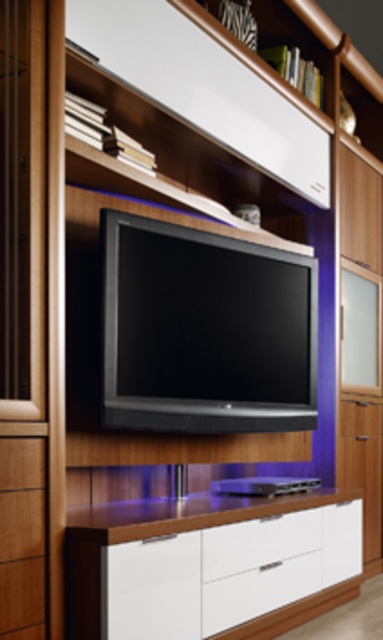
You are organizing the entertainment unit and need to know which object takes up more space. Which one is larger in size between the black glossy flat screen tv at center and the white glossy drawer at lower center?

The white glossy drawer at lower center is larger in size than the black glossy flat screen tv at center because the black glossy flat screen tv at center occupies less space than white glossy drawer at lower center.

You are organizing a living room and want to place a remote control on the entertainment unit. You have two drawers available for storage. Which drawer is positioned to the right when facing the entertainment unit, the white glossy drawer at lower center or the wooden drawer at lower left?

The white glossy drawer at lower center is positioned to the right of the wooden drawer at lower left.